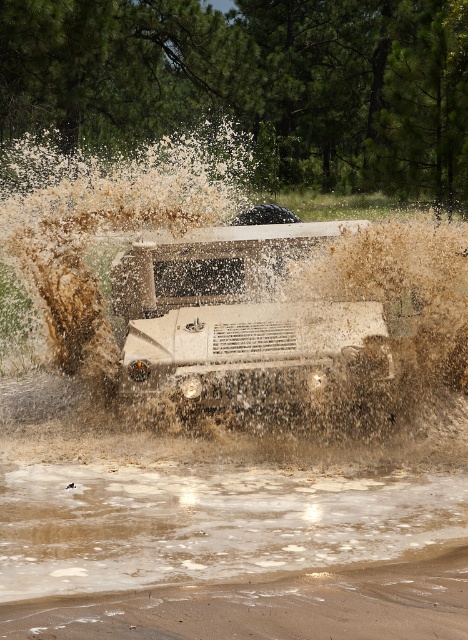
From the picture: You are a driver in the Humvee and want to exit the brown muddy water at lower center and return to the brown sandy dirt track at lower center. Which direction should you steer the vehicle to move from the muddy water to the dirt track?

The brown muddy water at lower center is further to the viewer than brown sandy dirt track at lower center, so to move from the muddy water to the dirt track, you should steer the vehicle backward or reverse direction to go towards the track which is behind relative to the current position.

You are a photographer trying to capture the white matte jeep at center from the brown sandy dirt track at lower center. Considering their sizes, which object would appear larger in your photo?

The white matte jeep at center is much taller than the brown sandy dirt track at lower center, so it would appear larger in the photo.

You are a photographer trying to capture the white matte jeep at center and the brown sandy dirt track at lower center in a single frame. Which object should you focus on first if you want to ensure both are in clear focus?

The white matte jeep at center has a larger size compared to brown sandy dirt track at lower center, so you should focus on the white matte jeep at center first to ensure both are in clear focus.